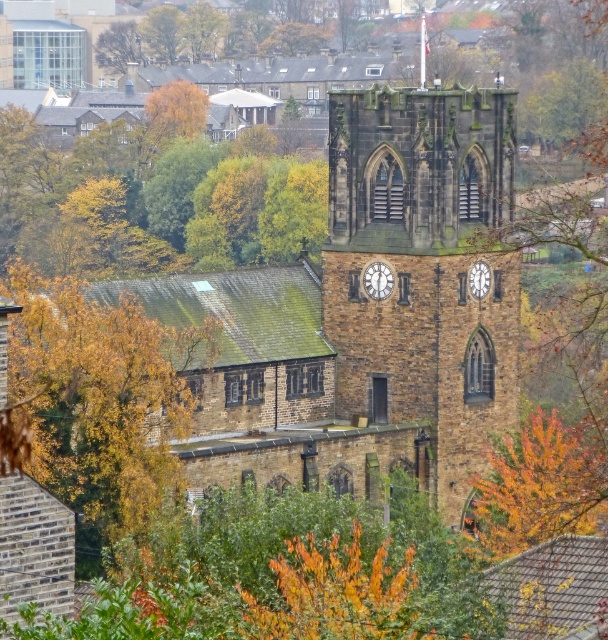
Can you confirm if golden leafy tree at center is positioned below white stone clock at upper center?

Yes.

Does golden leafy tree at center have a lesser height compared to white stone clock at upper center?

No.

Image resolution: width=608 pixels, height=640 pixels. Identify the location of golden leafy tree at center. (100, 403).

Based on the photo, is green leafy tree at upper center wider than autumn leaves at center?

Indeed, green leafy tree at upper center has a greater width compared to autumn leaves at center.

Is green leafy tree at upper center bigger than autumn leaves at center?

Correct, green leafy tree at upper center is larger in size than autumn leaves at center.

What do you see at coordinates (153, 195) in the screenshot? The height and width of the screenshot is (640, 608). I see `green leafy tree at upper center` at bounding box center [153, 195].

Where is `green leafy tree at upper center`? Image resolution: width=608 pixels, height=640 pixels. green leafy tree at upper center is located at coordinates (153, 195).

How far apart are autumn leaves at center and matte stone clock at center?

autumn leaves at center is 13.17 meters from matte stone clock at center.

Based on the photo, is autumn leaves at center above matte stone clock at center?

No, autumn leaves at center is not above matte stone clock at center.

Between point (589, 506) and point (378, 284), which one is positioned in front?

Point (589, 506)

Locate an element on the screen. The height and width of the screenshot is (640, 608). autumn leaves at center is located at coordinates (539, 484).